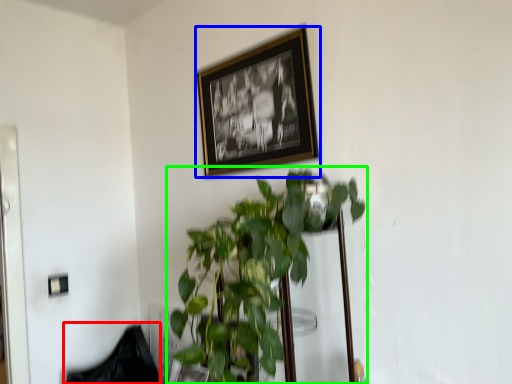
Question: Considering the real-world distances, which object is farthest from swivel chair (highlighted by a red box)? picture frame (highlighted by a blue box) or houseplant (highlighted by a green box)?

Choices:
 (A) picture frame
 (B) houseplant

Answer: (A)